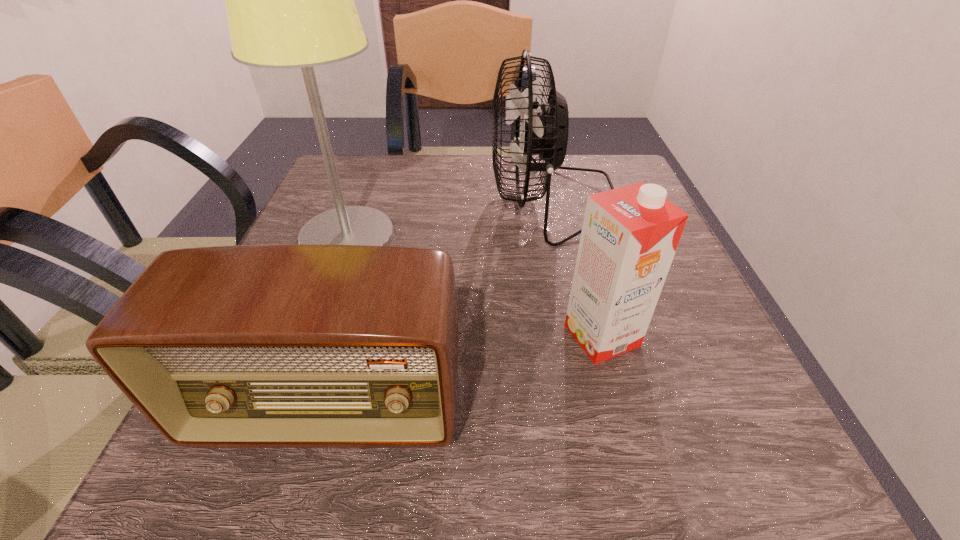
Find the location of `vacant space at the far left corner of the desktop`. vacant space at the far left corner of the desktop is located at coordinates (384, 156).

Where is `blank area at the near right corner`? This screenshot has width=960, height=540. blank area at the near right corner is located at coordinates (726, 438).

Identify the location of empty space that is in between the table lamp and the second tallest object. (450, 219).

Locate an element on the screen. The width and height of the screenshot is (960, 540). vacant point located between the carton and the table lamp is located at coordinates (475, 287).

In order to click on unoccupied position between the tallest object and the fan in this screenshot , I will do `click(450, 219)`.

This screenshot has width=960, height=540. Find the location of `free space between the radio receiver and the carton`. free space between the radio receiver and the carton is located at coordinates (467, 373).

Locate an element on the screen. vacant point located between the second nearest object and the table lamp is located at coordinates (475, 287).

Locate which object is the closest to the tallest object. Please provide its 2D coordinates. Your answer should be formatted as a tuple, i.e. [(x, y)], where the tuple contains the x and y coordinates of a point satisfying the conditions above.

[(544, 131)]

The image size is (960, 540). What are the coordinates of `the third closest object to the nearest object` in the screenshot? It's located at (544, 131).

Where is `vacant region that satisfies the following two spatial constraints: 1. on the back side of the carton; 2. in front of the second tallest object, directing airflow`? vacant region that satisfies the following two spatial constraints: 1. on the back side of the carton; 2. in front of the second tallest object, directing airflow is located at coordinates (566, 201).